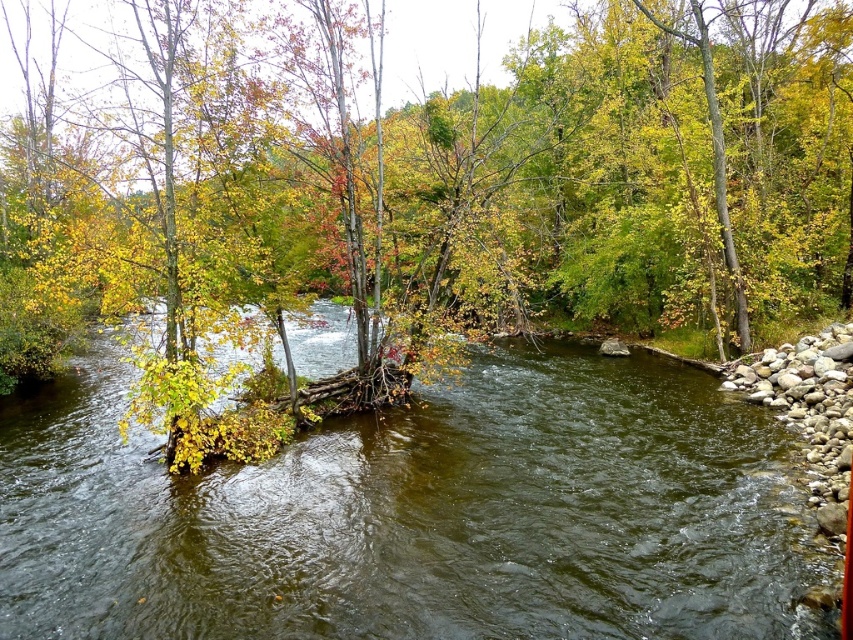
Question: Which of the following is the farthest from the observer?

Choices:
 (A) (463, 230)
 (B) (752, 508)

Answer: (A)

Question: Does yellow-green leaves at center have a greater width compared to greenish-brown water at center?

Choices:
 (A) yes
 (B) no

Answer: (A)

Question: Observing the image, what is the correct spatial positioning of yellow-green leaves at center in reference to greenish-brown water at center?

Choices:
 (A) left
 (B) right

Answer: (B)

Question: Which point is farther to the camera?

Choices:
 (A) greenish-brown water at center
 (B) yellow-green leaves at center

Answer: (B)

Question: Does yellow-green leaves at center have a larger size compared to greenish-brown water at center?

Choices:
 (A) no
 (B) yes

Answer: (B)

Question: Which of the following is the farthest from the observer?

Choices:
 (A) greenish-brown water at center
 (B) yellow-green leaves at center

Answer: (B)